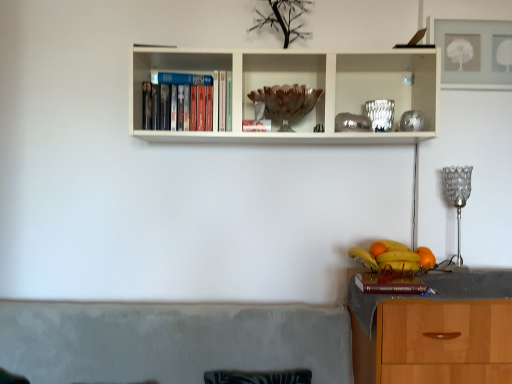
Question: Is the position of yellow matte bananas at lower right less distant than that of brown wooden bowl at center?

Choices:
 (A) no
 (B) yes

Answer: (B)

Question: Is brown wooden bowl at center a part of yellow matte bananas at lower right?

Choices:
 (A) yes
 (B) no

Answer: (B)

Question: Can you confirm if yellow matte bananas at lower right is positioned to the right of brown wooden bowl at center?

Choices:
 (A) no
 (B) yes

Answer: (B)

Question: Is brown wooden bowl at center at the back of yellow matte bananas at lower right?

Choices:
 (A) no
 (B) yes

Answer: (A)

Question: Is yellow matte bananas at lower right beside brown wooden bowl at center?

Choices:
 (A) yes
 (B) no

Answer: (B)

Question: Considering the relative sizes of yellow matte bananas at lower right and brown wooden bowl at center in the image provided, is yellow matte bananas at lower right taller than brown wooden bowl at center?

Choices:
 (A) no
 (B) yes

Answer: (A)

Question: From the image's perspective, is orange matte at right, the second orange in the right-to-left sequence, located beneath brown wooden bowl at center?

Choices:
 (A) yes
 (B) no

Answer: (A)

Question: Does orange matte at right, arranged as the second orange when viewed from the front, appear on the right side of brown wooden bowl at center?

Choices:
 (A) no
 (B) yes

Answer: (B)

Question: Is brown wooden bowl at center inside orange matte at right, the first orange from the left?

Choices:
 (A) no
 (B) yes

Answer: (A)

Question: Is the position of orange matte at right, the first orange from the left, more distant than that of brown wooden bowl at center?

Choices:
 (A) no
 (B) yes

Answer: (A)

Question: Can we say orange matte at right, the first orange from the left, lies outside brown wooden bowl at center?

Choices:
 (A) yes
 (B) no

Answer: (A)

Question: Is orange matte at right, arranged as the second orange when viewed from the front, aimed at brown wooden bowl at center?

Choices:
 (A) no
 (B) yes

Answer: (A)

Question: Can you confirm if brown wooden bowl at center is positioned to the left of silver metallic lamp at right?

Choices:
 (A) yes
 (B) no

Answer: (A)